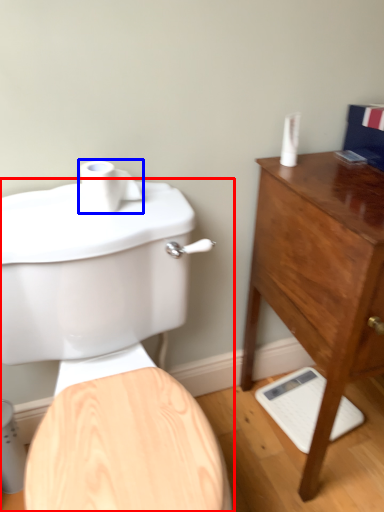
Question: Which object appears farthest to the camera in this image, toilet (highlighted by a red box) or toilet paper (highlighted by a blue box)?

Choices:
 (A) toilet
 (B) toilet paper

Answer: (B)